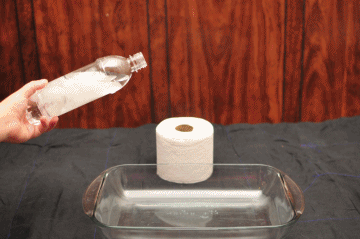
Locate an element on the screen. toilet paper is located at coordinates (184, 112).